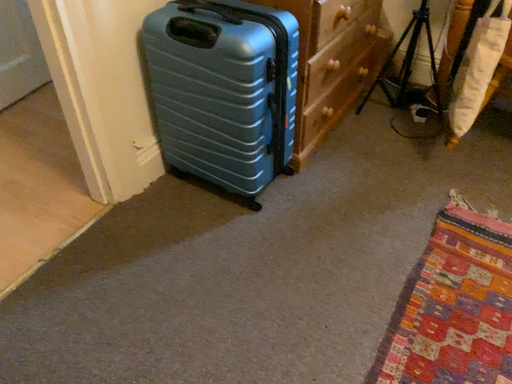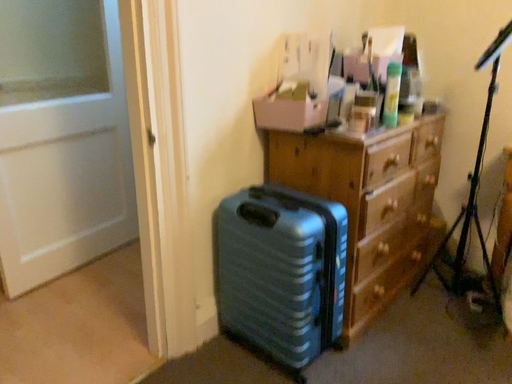
Question: How did the camera likely rotate when shooting the video?

Choices:
 (A) rotated left
 (B) rotated right

Answer: (A)